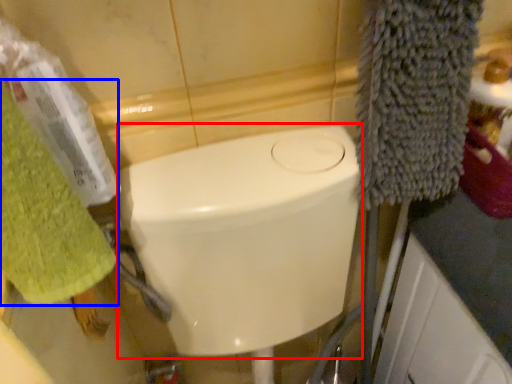
Question: Which object appears farthest to the camera in this image, bidet (highlighted by a red box) or towel/napkin (highlighted by a blue box)?

Choices:
 (A) bidet
 (B) towel/napkin

Answer: (A)